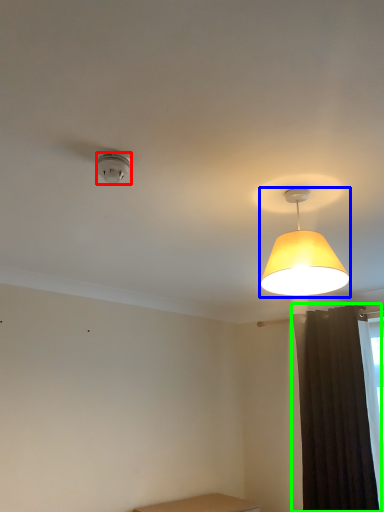
Question: Considering the real-world distances, which object is closest to lamp (highlighted by a red box)? lamp (highlighted by a blue box) or curtain (highlighted by a green box).

Choices:
 (A) lamp
 (B) curtain

Answer: (A)